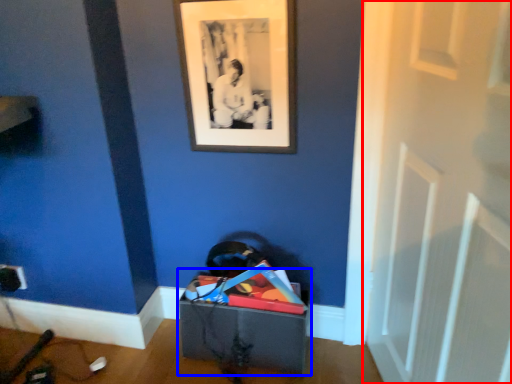
Question: Which object appears closest to the camera in this image, door (highlighted by a red box) or storage box (highlighted by a blue box)?

Choices:
 (A) door
 (B) storage box

Answer: (A)